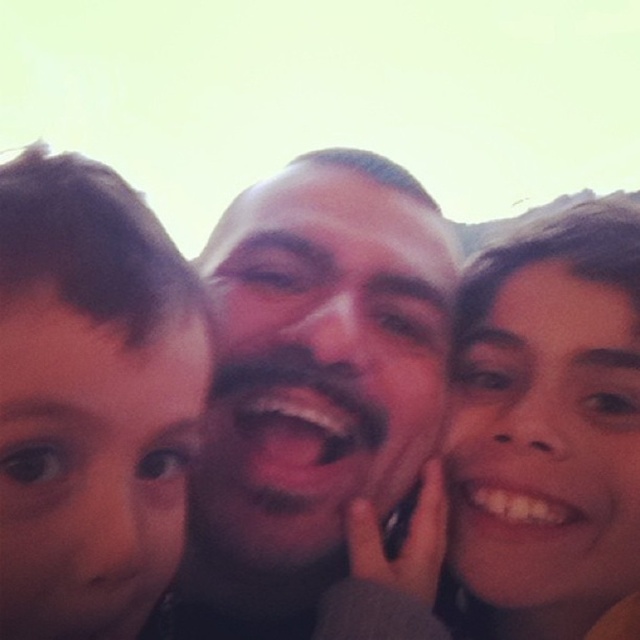
Does smooth skin face at center have a greater width compared to brown hair at left?

Yes, smooth skin face at center is wider than brown hair at left.

Who is more distant from viewer, (264, 214) or (42, 474)?

The point (264, 214) is more distant.

Locate an element on the screen. Image resolution: width=640 pixels, height=640 pixels. smooth skin face at center is located at coordinates (310, 387).

Which of these two, smooth skin at center or brown hair at left, stands shorter?

With less height is brown hair at left.

Locate an element on the screen. This screenshot has height=640, width=640. smooth skin at center is located at coordinates 524,451.

Where is `smooth skin at center`? The width and height of the screenshot is (640, 640). smooth skin at center is located at coordinates (524, 451).

This screenshot has width=640, height=640. What are the coordinates of `smooth skin face at center` in the screenshot? It's located at (310, 387).

Who is higher up, smooth skin face at center or smooth skin at center?

smooth skin face at center is higher up.

Who is more distant from viewer, (291,280) or (572,342)?

The point (572,342) is behind.

Identify the location of smooth skin face at center. Image resolution: width=640 pixels, height=640 pixels. (310, 387).